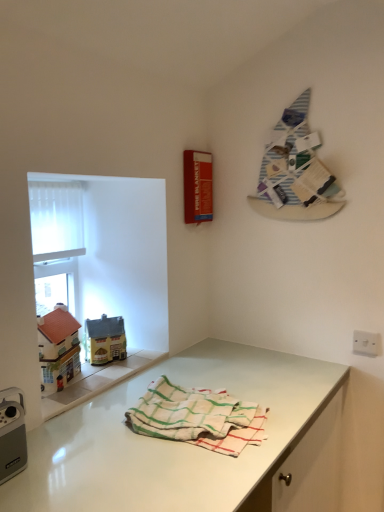
The image size is (384, 512). Find the location of `free location to the right of matte plastic toy house at left, the 1th toy viewed from the front`. free location to the right of matte plastic toy house at left, the 1th toy viewed from the front is located at coordinates (96, 379).